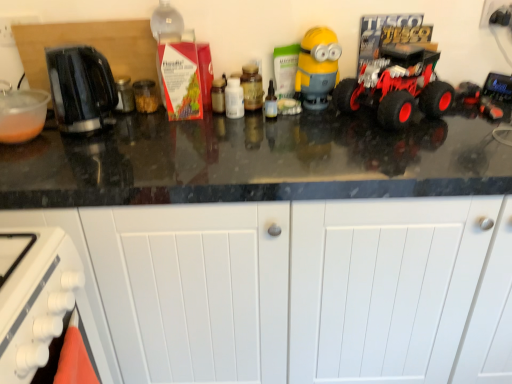
Question: From a real-world perspective, is matte brown jar at center, placed as the 2th bottle when sorted from left to right, above or below rubberized red truck at right?

Choices:
 (A) below
 (B) above

Answer: (A)

Question: Is matte brown jar at center, which is the second bottle from right to left, to the left or to the right of rubberized red truck at right in the image?

Choices:
 (A) right
 (B) left

Answer: (B)

Question: Considering the real-world distances, which object is closest to the white matte cabinet at lower center?

Choices:
 (A) yellow matte minion at center
 (B) transparent glass bottle at center, arranged as the 1th bottle when viewed from the right
 (C) black plastic toaster at left
 (D) matte brown jar at center, which is the second bottle from right to left
 (E) white plastic bottle at center, placed as the 3th bottle when sorted from right to left

Answer: (B)

Question: Considering the real-world distances, which object is closest to the black plastic toaster at left?

Choices:
 (A) rubberized red truck at right
 (B) white matte cabinet at lower center
 (C) matte brown jar at center, which is the second bottle from right to left
 (D) white plastic bottle at center, placed as the 3th bottle when sorted from right to left
 (E) yellow matte minion at center

Answer: (D)